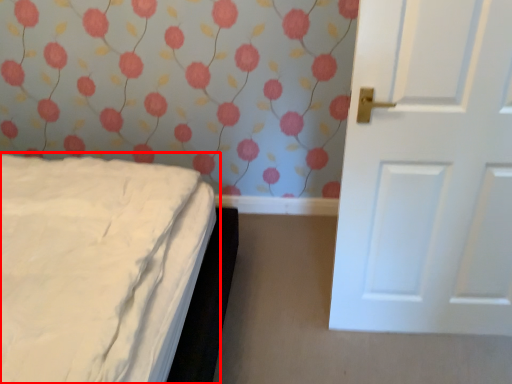
Question: Considering the relative positions of bed (annotated by the red box) and door in the image provided, where is bed (annotated by the red box) located with respect to the staircase?

Choices:
 (A) right
 (B) left

Answer: (B)